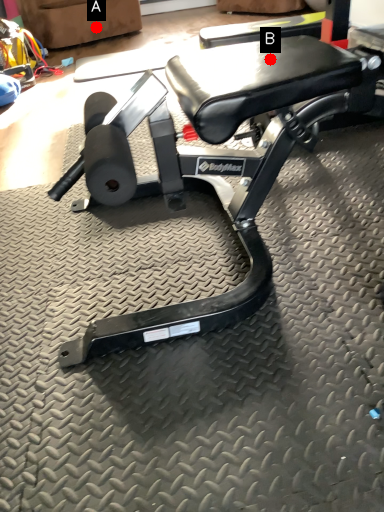
Question: Two points are circled on the image, labeled by A and B beside each circle. Which point is further to the camera?

Choices:
 (A) A is further
 (B) B is further

Answer: (A)